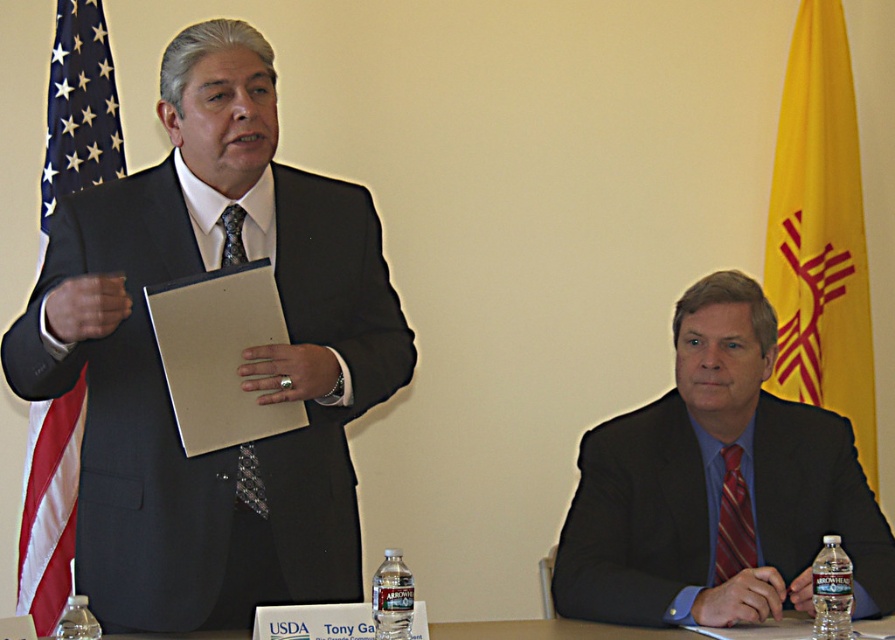
Can you confirm if matte black suit at left is bigger than yellow fabric flag at upper right?

Correct, matte black suit at left is larger in size than yellow fabric flag at upper right.

Can you confirm if matte black suit at left is positioned below yellow fabric flag at upper right?

Correct, matte black suit at left is located below yellow fabric flag at upper right.

Find the location of a particular element. The width and height of the screenshot is (895, 640). matte black suit at left is located at coordinates (245, 355).

Which of these two, matte black suit at left or black textured tie at left, stands shorter?

Standing shorter between the two is black textured tie at left.

Does point (109, 406) come farther from viewer compared to point (231, 230)?

No, (109, 406) is closer to viewer.

You are a GUI agent. You are given a task and a screenshot of the screen. Output one action in this format:
    pyautogui.click(x=<x>, y=<y>)
    Task: Click on the matte black suit at left
    
    Given the screenshot: What is the action you would take?
    pyautogui.click(x=245, y=355)

Who is more distant from viewer, (746,442) or (239,252)?

The point (746,442) is more distant.

From the picture: Does matte black suit at right appear on the right side of black textured tie at left?

Yes, matte black suit at right is to the right of black textured tie at left.

Does point (668, 554) lie behind point (222, 266)?

That is True.

Find the location of a particular element. The height and width of the screenshot is (640, 895). matte black suit at right is located at coordinates (717, 486).